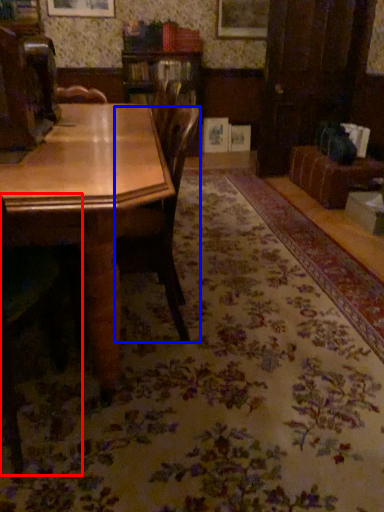
Question: Which object is closer to the camera taking this photo, chair (highlighted by a red box) or chair (highlighted by a blue box)?

Choices:
 (A) chair
 (B) chair

Answer: (A)